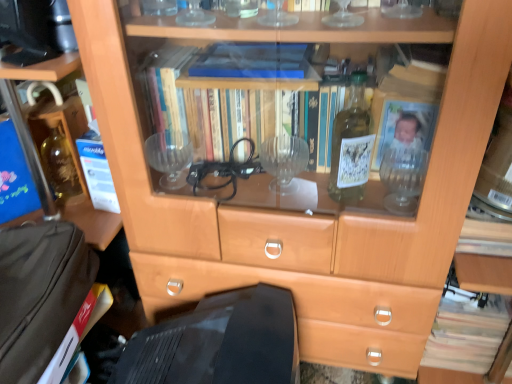
Question: Does brown fabric suitcase at lower left have a lesser height compared to light brown paper book at lower right?

Choices:
 (A) no
 (B) yes

Answer: (B)

Question: From a real-world perspective, is brown fabric suitcase at lower left below light brown paper book at lower right?

Choices:
 (A) no
 (B) yes

Answer: (A)

Question: Would you say brown fabric suitcase at lower left contains light brown paper book at lower right?

Choices:
 (A) no
 (B) yes

Answer: (A)

Question: From a real-world perspective, is brown fabric suitcase at lower left on light brown paper book at lower right?

Choices:
 (A) no
 (B) yes

Answer: (B)

Question: Does brown fabric suitcase at lower left touch light brown paper book at lower right?

Choices:
 (A) yes
 (B) no

Answer: (B)

Question: Could you tell me if brown fabric suitcase at lower left is facing light brown paper book at lower right?

Choices:
 (A) no
 (B) yes

Answer: (A)

Question: Does light brown paper book at lower right touch brown fabric suitcase at lower left?

Choices:
 (A) yes
 (B) no

Answer: (B)

Question: From a real-world perspective, is light brown paper book at lower right below brown fabric suitcase at lower left?

Choices:
 (A) yes
 (B) no

Answer: (A)

Question: Is brown fabric suitcase at lower left surrounded by light brown paper book at lower right?

Choices:
 (A) yes
 (B) no

Answer: (B)

Question: From a real-world perspective, is light brown paper book at lower right positioned over brown fabric suitcase at lower left based on gravity?

Choices:
 (A) no
 (B) yes

Answer: (A)

Question: Is light brown paper book at lower right bigger than brown fabric suitcase at lower left?

Choices:
 (A) no
 (B) yes

Answer: (B)

Question: Is light brown paper book at lower right facing away from brown fabric suitcase at lower left?

Choices:
 (A) no
 (B) yes

Answer: (A)

Question: Is brown paper at left, placed as the first paperback book when sorted from bottom to top, wider than white paper at left, which is the 1th paperback book in top-to-bottom order?

Choices:
 (A) yes
 (B) no

Answer: (A)